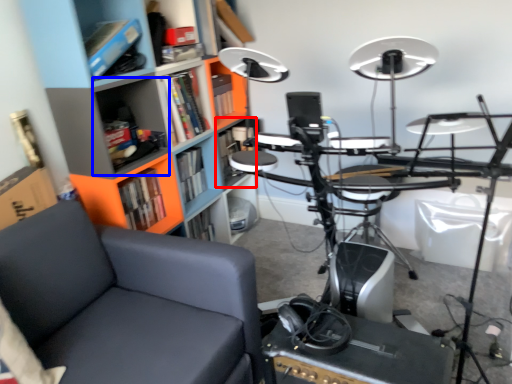
Question: Which of the following is the closest to the observer, shelf (highlighted by a red box) or shelf (highlighted by a blue box)?

Choices:
 (A) shelf
 (B) shelf

Answer: (B)